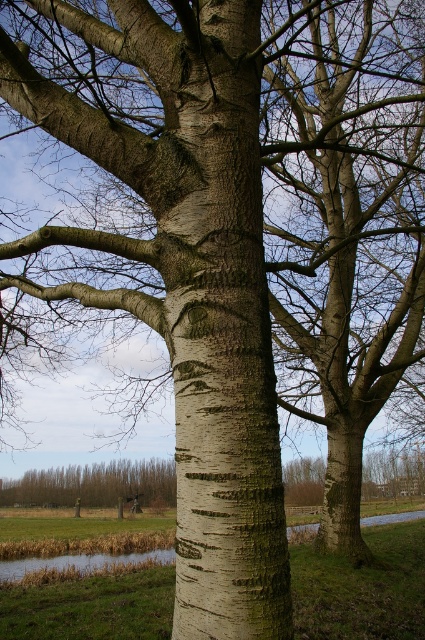
Is white bark tree trunk at center closer to camera compared to brown rough bark tree at lower left?

Yes.

Can you confirm if white bark tree trunk at center is positioned above brown rough bark tree at lower left?

Yes, white bark tree trunk at center is above brown rough bark tree at lower left.

Image resolution: width=425 pixels, height=640 pixels. What do you see at coordinates (218, 323) in the screenshot?
I see `white bark tree trunk at center` at bounding box center [218, 323].

Identify the location of white bark tree trunk at center. This screenshot has height=640, width=425. tap(218, 323).